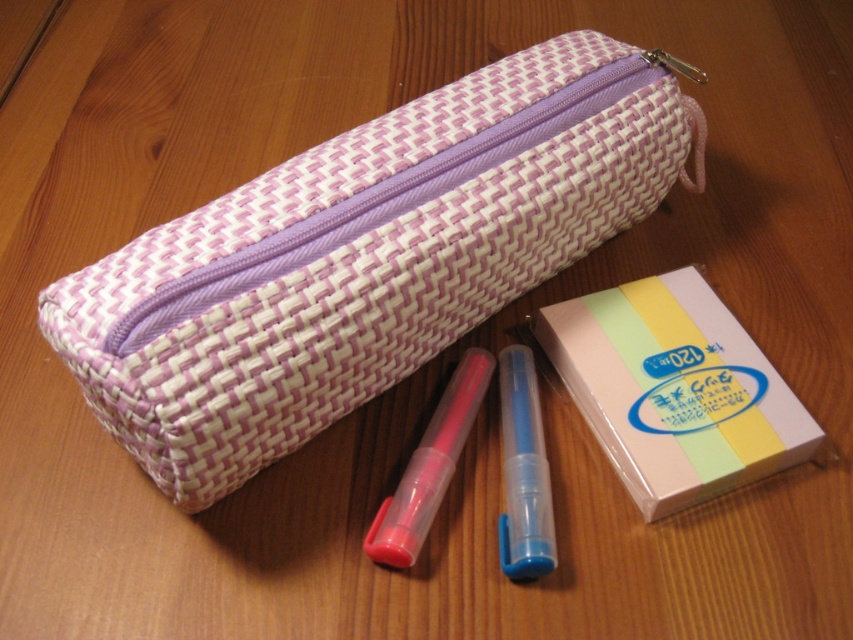
You are a GUI agent. You are given a task and a screenshot of the screen. Output one action in this format:
    pyautogui.click(x=<x>, y=<y>)
    Task: Click on the woven fabric pencil case at center
    The image size is (853, 640).
    Given the screenshot: What is the action you would take?
    pyautogui.click(x=361, y=259)

Does woven fabric pencil case at center have a lesser height compared to translucent plastic pen at center?

No, woven fabric pencil case at center is not shorter than translucent plastic pen at center.

Is point (90, 312) behind point (531, 396)?

No, (90, 312) is in front of (531, 396).

I want to click on woven fabric pencil case at center, so click(x=361, y=259).

Can you confirm if pastel striped paper at lower right is shorter than translucent plastic pen at center?

No.

Which is more to the right, pastel striped paper at lower right or translucent plastic pen at center?

pastel striped paper at lower right is more to the right.

Which is in front, point (622, 372) or point (517, 396)?

Point (622, 372) is in front.

Locate an element on the screen. The width and height of the screenshot is (853, 640). pastel striped paper at lower right is located at coordinates (674, 388).

Can you confirm if woven fabric pencil case at center is positioned to the left of pink matte pen at center?

Yes, woven fabric pencil case at center is to the left of pink matte pen at center.

Which is below, woven fabric pencil case at center or pink matte pen at center?

Positioned lower is pink matte pen at center.

Who is more distant from viewer, (386, 116) or (418, 499)?

Positioned behind is point (386, 116).

Find the location of a particular element. Image resolution: width=853 pixels, height=640 pixels. woven fabric pencil case at center is located at coordinates (361, 259).